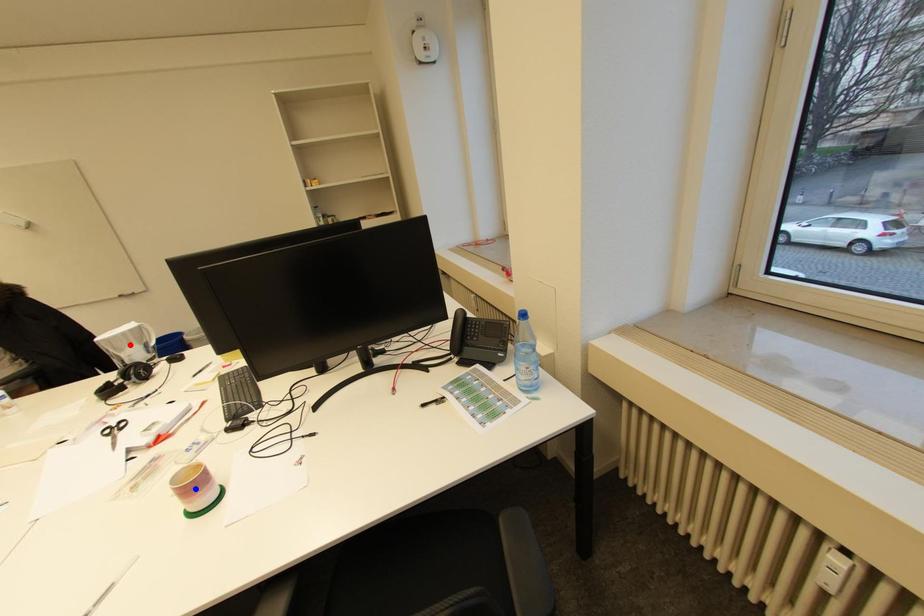
Question: Two points are marked on the image. Which point is closer to the camera?

Choices:
 (A) Blue point is closer.
 (B) Red point is closer.

Answer: (A)